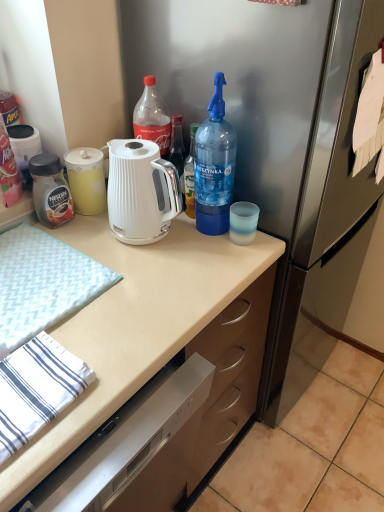
Find the location of `free space to the right of white glossy electric kettle at center`. free space to the right of white glossy electric kettle at center is located at coordinates (218, 253).